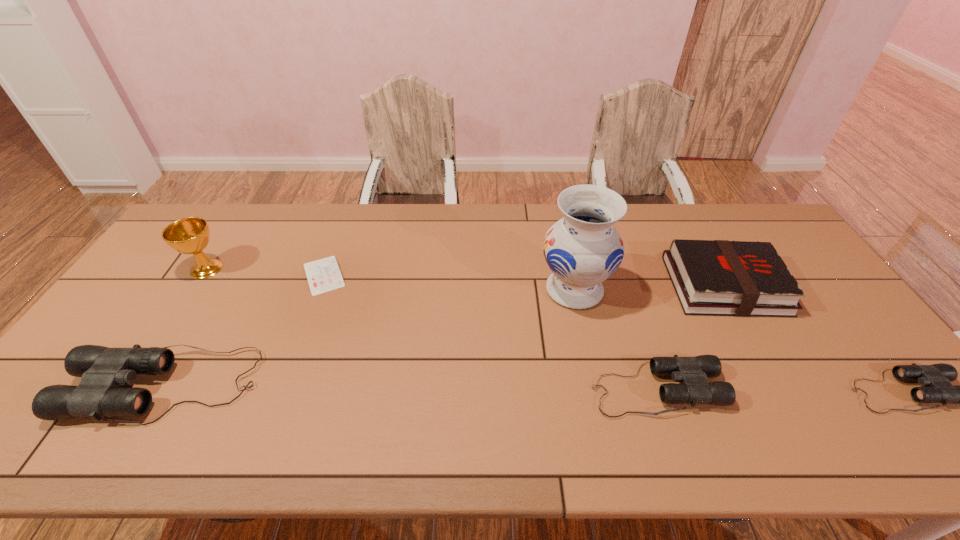
Please point a space for a new binoculars to maintain equal intervals. Please provide its 2D coordinates. Your answer should be formatted as a tuple, i.e. [(x, y)], where the tuple contains the x and y coordinates of a point satisfying the conditions above.

[(410, 388)]